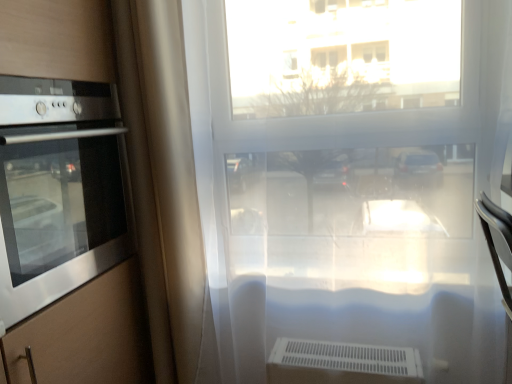
Question: Would you say beige fabric curtain at left is a long distance from transparent plastic window at center?

Choices:
 (A) no
 (B) yes

Answer: (A)

Question: From a real-world perspective, is beige fabric curtain at left beneath transparent plastic window at center?

Choices:
 (A) no
 (B) yes

Answer: (A)

Question: Considering the relative sizes of beige fabric curtain at left and transparent plastic window at center in the image provided, is beige fabric curtain at left shorter than transparent plastic window at center?

Choices:
 (A) yes
 (B) no

Answer: (A)

Question: Considering the relative sizes of beige fabric curtain at left and transparent plastic window at center in the image provided, is beige fabric curtain at left smaller than transparent plastic window at center?

Choices:
 (A) yes
 (B) no

Answer: (A)

Question: From a real-world perspective, is beige fabric curtain at left positioned over transparent plastic window at center based on gravity?

Choices:
 (A) yes
 (B) no

Answer: (A)

Question: Is beige fabric curtain at left with transparent plastic window at center?

Choices:
 (A) no
 (B) yes

Answer: (A)

Question: Does stainless steel oven at left have a greater height compared to beige fabric curtain at left?

Choices:
 (A) no
 (B) yes

Answer: (A)

Question: Is stainless steel oven at left with beige fabric curtain at left?

Choices:
 (A) yes
 (B) no

Answer: (B)

Question: Is stainless steel oven at left closer to camera compared to beige fabric curtain at left?

Choices:
 (A) yes
 (B) no

Answer: (A)

Question: Is stainless steel oven at left thinner than beige fabric curtain at left?

Choices:
 (A) yes
 (B) no

Answer: (B)

Question: From a real-world perspective, is stainless steel oven at left located higher than beige fabric curtain at left?

Choices:
 (A) yes
 (B) no

Answer: (A)

Question: From the image's perspective, does stainless steel oven at left appear lower than beige fabric curtain at left?

Choices:
 (A) no
 (B) yes

Answer: (A)

Question: From the image's perspective, is beige fabric curtain at left located above stainless steel oven at left?

Choices:
 (A) yes
 (B) no

Answer: (B)